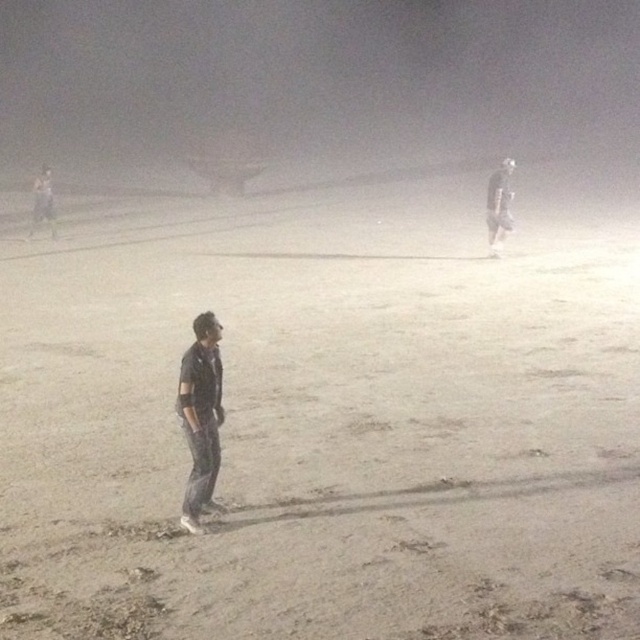
You are standing in the nighttime scene and want to walk towards the gray sandy field at center. Based on the coordinates provided, in which general direction should you move from your current position?

The gray sandy field at center is located at coordinates point (x=324, y=420), so you should move towards the right direction from your current position.

You are a photographer trying to capture a silhouette of the dark gray jeans at upper left against the gray sandy field at center. Based on the scene, will the jeans appear taller than the field in your photo?

The gray sandy field at center is much taller than the dark gray jeans at upper left, so in the photo, the field will appear taller than the jeans.